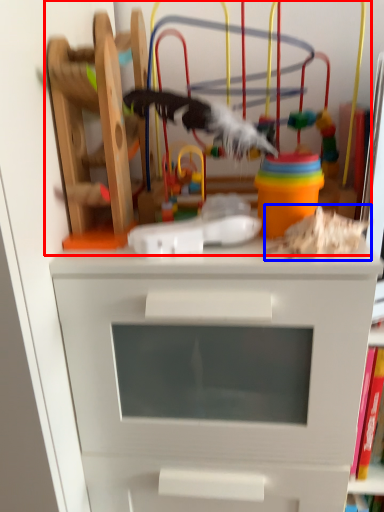
Question: Which point is closer to the camera, toy (highlighted by a red box) or toy (highlighted by a blue box)?

Choices:
 (A) toy
 (B) toy

Answer: (B)